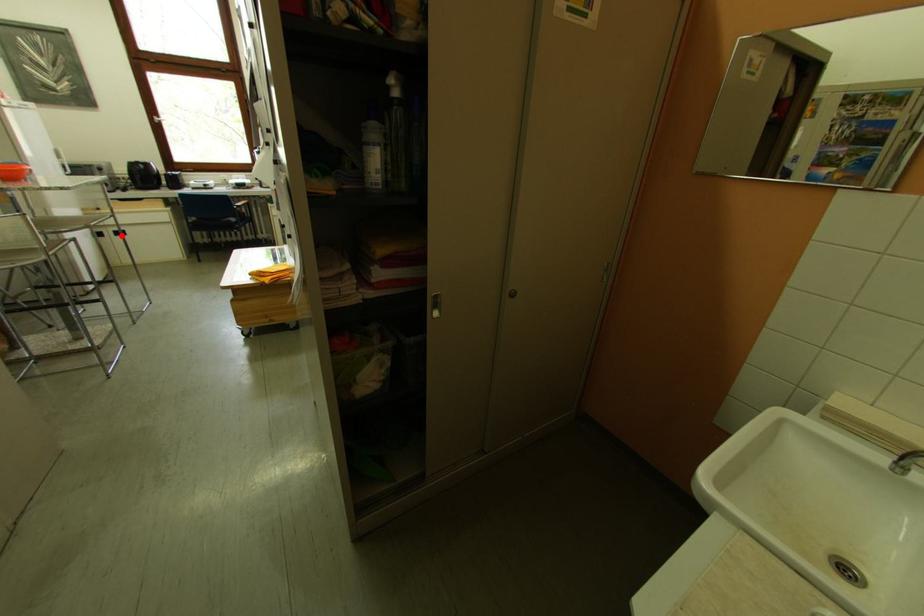
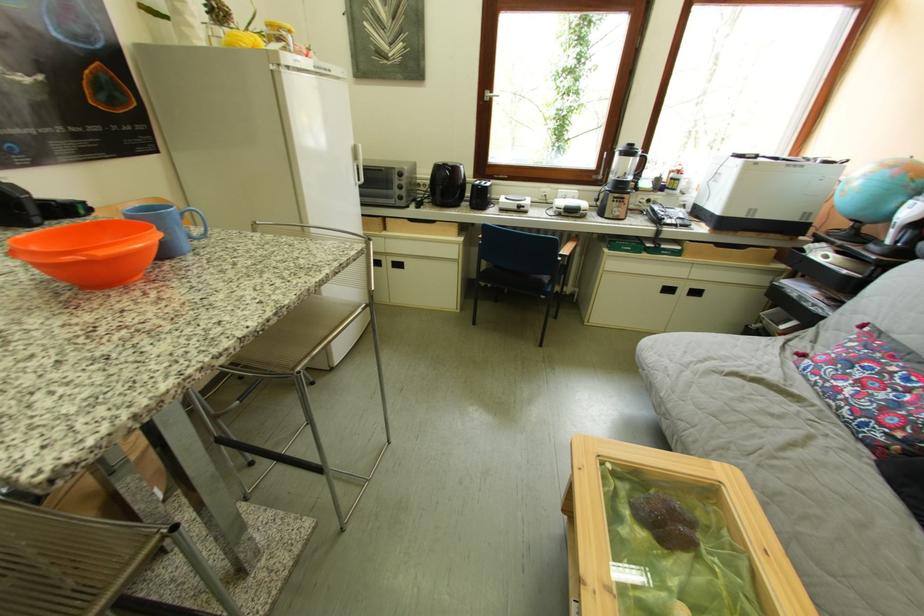
Find the pixel in the second image that matches the highlighted location in the first image.

(399, 265)